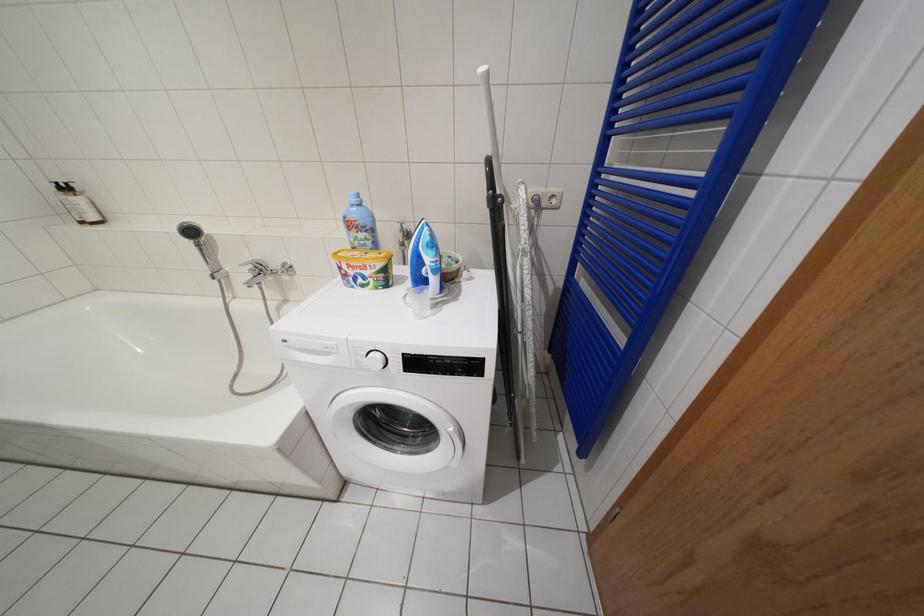
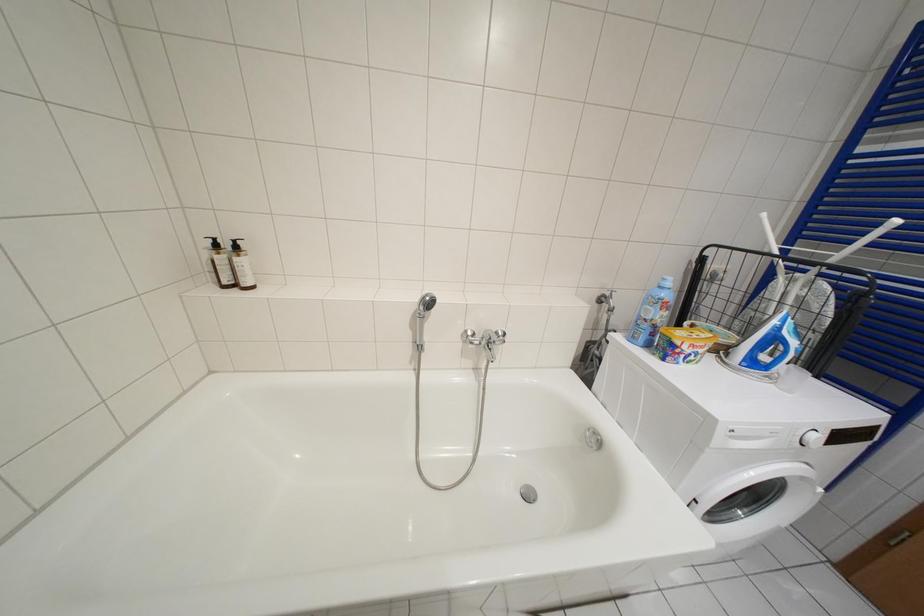
Question: Which direction would the cameraman need to move to produce the second image? Reply with the corresponding letter.

Choices:
 (A) Left
 (B) Right
 (C) Forward
 (D) Backward

Answer: (A)